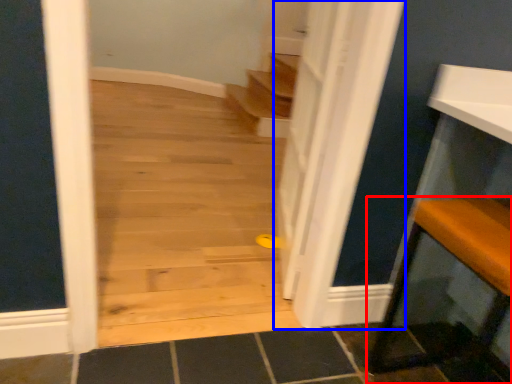
Question: Which object appears closest to the camera in this image, furniture (highlighted by a red box) or door (highlighted by a blue box)?

Choices:
 (A) furniture
 (B) door

Answer: (A)